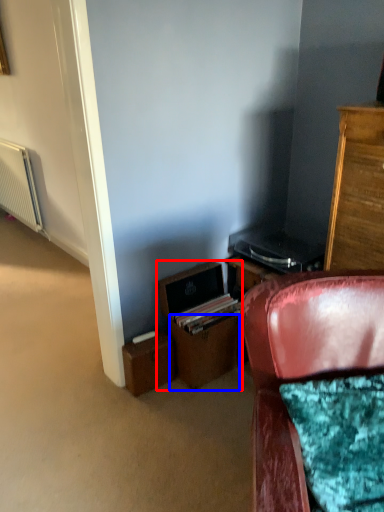
Question: Which of the following is the farthest to the observer, file cabinet (highlighted by a red box) or drawer (highlighted by a blue box)?

Choices:
 (A) file cabinet
 (B) drawer

Answer: (B)